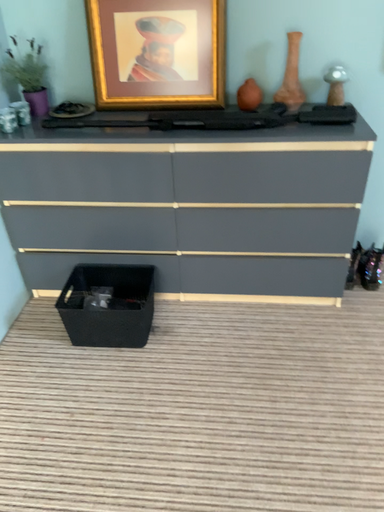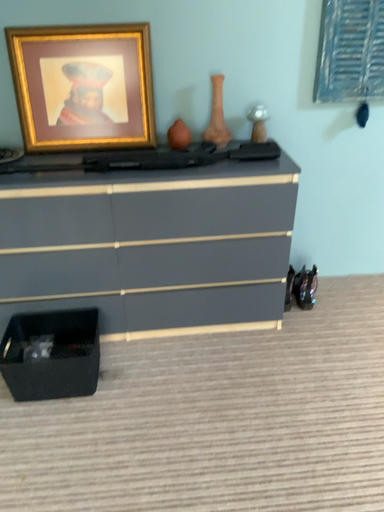
Question: How did the camera likely rotate when shooting the video?

Choices:
 (A) rotated left
 (B) rotated right

Answer: (B)